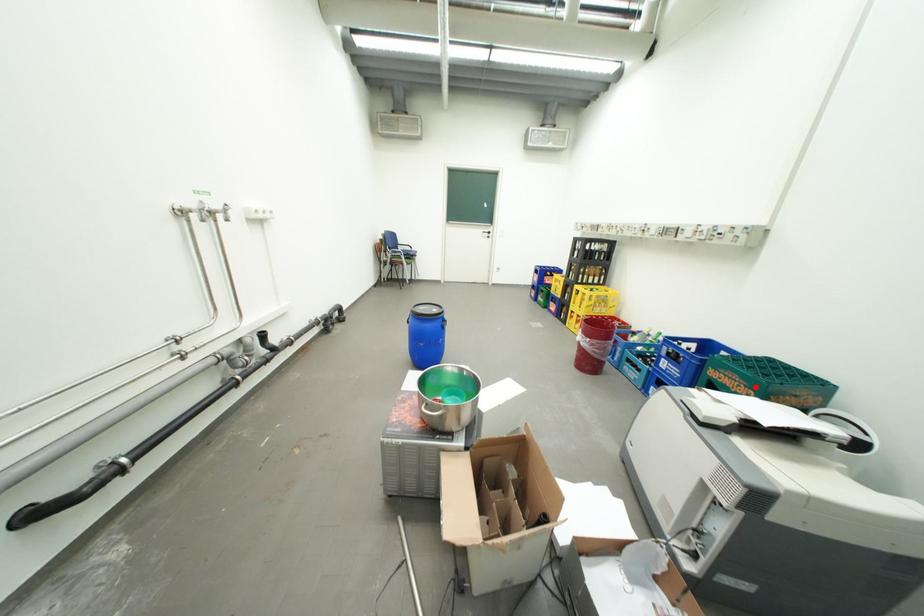
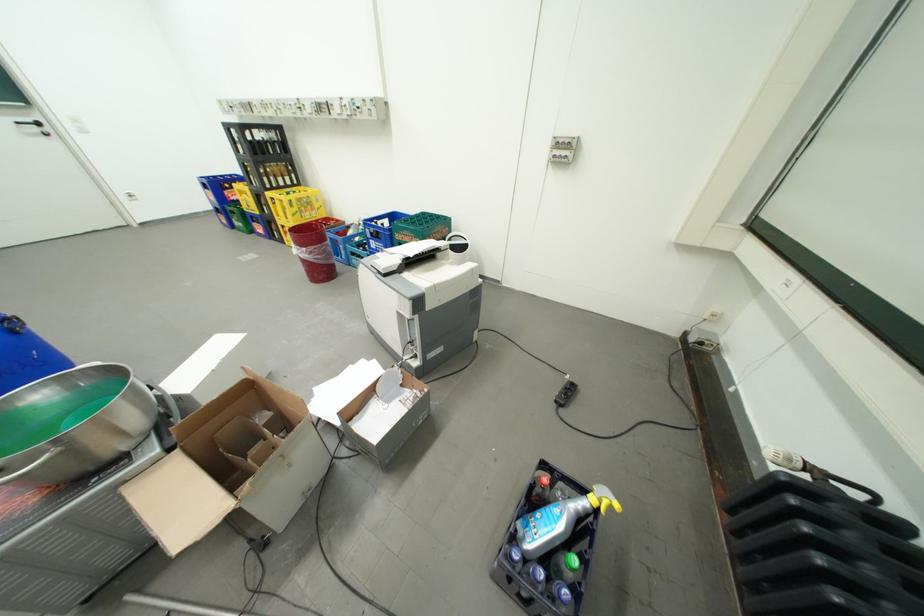
Question: I am providing you with two images of the same scene from different viewpoints. In image1, a red point is highlighted. Considering the same 3D point in image2, which of the following is correct?

Choices:
 (A) It is closer
 (B) It is farther

Answer: (B)